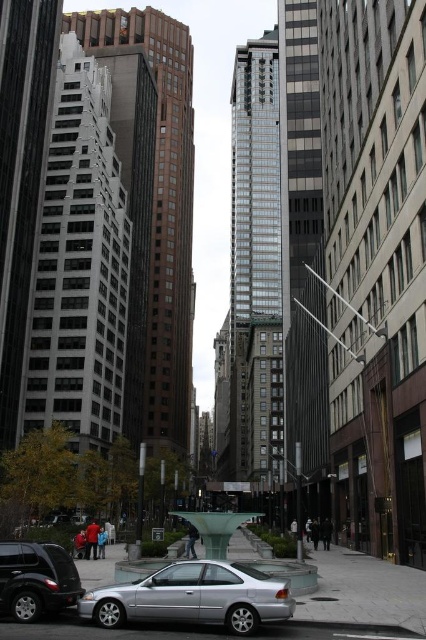
From the picture: Can you confirm if silver metallic car at lower left is positioned below shiny black suv at lower left?

Correct, silver metallic car at lower left is located below shiny black suv at lower left.

Image resolution: width=426 pixels, height=640 pixels. Find the location of `silver metallic car at lower left`. silver metallic car at lower left is located at coordinates (193, 596).